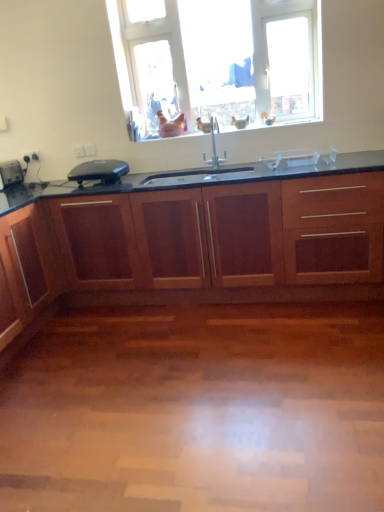
Question: Is matte black toaster at left, arranged as the 3th appliance when viewed from the right, turned away from black plastic toaster at left, placed as the second appliance when sorted from right to left?

Choices:
 (A) no
 (B) yes

Answer: (A)

Question: Does matte black toaster at left, arranged as the 3th appliance when viewed from the right, have a lesser height compared to black plastic toaster at left, the second appliance when ordered from left to right?

Choices:
 (A) yes
 (B) no

Answer: (B)

Question: Are matte black toaster at left, arranged as the 3th appliance when viewed from the right, and black plastic toaster at left, placed as the second appliance when sorted from right to left, far apart?

Choices:
 (A) no
 (B) yes

Answer: (A)

Question: Can you confirm if matte black toaster at left, arranged as the 3th appliance when viewed from the right, is positioned to the right of black plastic toaster at left, the second appliance when ordered from left to right?

Choices:
 (A) no
 (B) yes

Answer: (A)

Question: From the image's perspective, is matte black toaster at left, arranged as the 3th appliance when viewed from the right, over black plastic toaster at left, placed as the second appliance when sorted from right to left?

Choices:
 (A) no
 (B) yes

Answer: (B)

Question: From a real-world perspective, is matte black toaster at left, arranged as the 3th appliance when viewed from the right, under black plastic toaster at left, the second appliance when ordered from left to right?

Choices:
 (A) no
 (B) yes

Answer: (A)

Question: From the image's perspective, is mahogany wood cabinetry at center on top of matte black toaster at left, arranged as the 3th appliance when viewed from the right?

Choices:
 (A) yes
 (B) no

Answer: (B)

Question: Is mahogany wood cabinetry at center smaller than matte black toaster at left, the first appliance when ordered from left to right?

Choices:
 (A) no
 (B) yes

Answer: (A)

Question: Considering the relative sizes of mahogany wood cabinetry at center and matte black toaster at left, arranged as the 3th appliance when viewed from the right, in the image provided, is mahogany wood cabinetry at center shorter than matte black toaster at left, arranged as the 3th appliance when viewed from the right,?

Choices:
 (A) yes
 (B) no

Answer: (B)

Question: Is mahogany wood cabinetry at center thinner than matte black toaster at left, the first appliance when ordered from left to right?

Choices:
 (A) no
 (B) yes

Answer: (A)

Question: Is mahogany wood cabinetry at center facing away from matte black toaster at left, arranged as the 3th appliance when viewed from the right?

Choices:
 (A) yes
 (B) no

Answer: (B)

Question: Is mahogany wood cabinetry at center not within matte black toaster at left, the first appliance when ordered from left to right?

Choices:
 (A) yes
 (B) no

Answer: (A)

Question: Is clear plastic container at center, the third appliance in the left-to-right sequence, surrounded by satin nickel faucet at center?

Choices:
 (A) no
 (B) yes

Answer: (A)